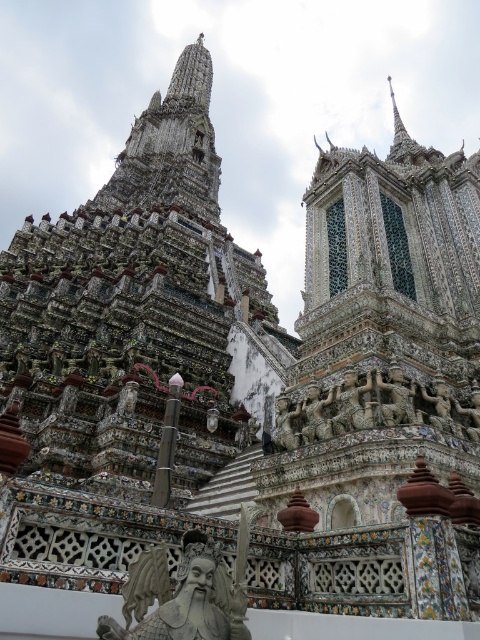
You are standing in front of Wat Arun and want to take a photo that includes both the gray stone statue at lower center and the carved stone figures at center. Which object should you position closer to the front of your camera frame to ensure both are visible?

You should position the gray stone statue at lower center closer to the front of your camera frame because it is already in front of the carved stone figures at center, allowing both to be captured in the photo.

You are an architect analyzing the structure of Wat Arun. You notice the gray stone statue at lower center and the carved stone figures at center. Which of these two elements is bigger in size?

The gray stone statue at lower center is larger in size than the carved stone figures at center.